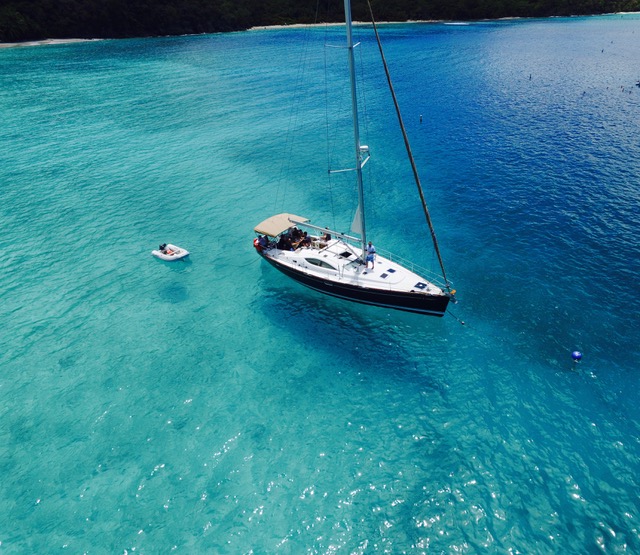
You are a GUI agent. You are given a task and a screenshot of the screen. Output one action in this format:
    pyautogui.click(x=<x>, y=<y>)
    Task: Click on the canopy
    Image resolution: width=640 pixels, height=555 pixels.
    Given the screenshot: What is the action you would take?
    pyautogui.click(x=281, y=225)